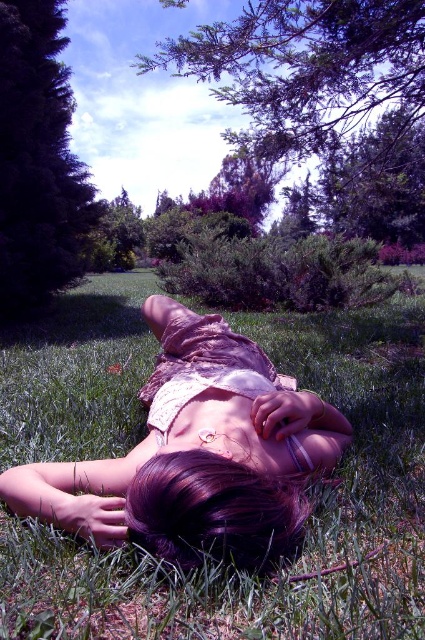
Question: Can you confirm if pink lace dress at center is positioned to the left of dark purple hair at center?

Choices:
 (A) yes
 (B) no

Answer: (A)

Question: Is pink lace dress at center above dark purple hair at center?

Choices:
 (A) yes
 (B) no

Answer: (A)

Question: Does pink lace dress at center have a smaller size compared to dark purple hair at center?

Choices:
 (A) no
 (B) yes

Answer: (A)

Question: Which of the following is the farthest from the observer?

Choices:
 (A) dark purple hair at center
 (B) pink lace dress at center

Answer: (B)